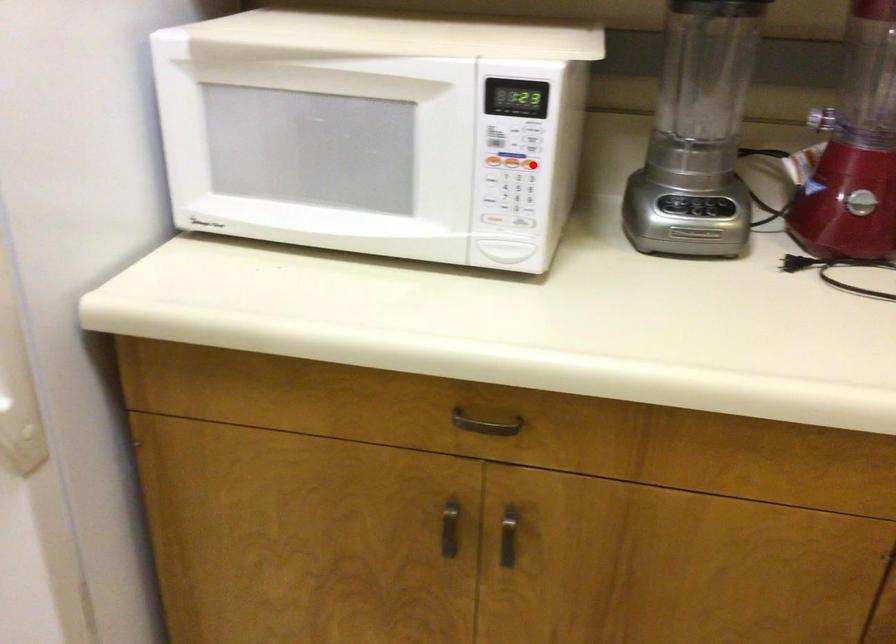
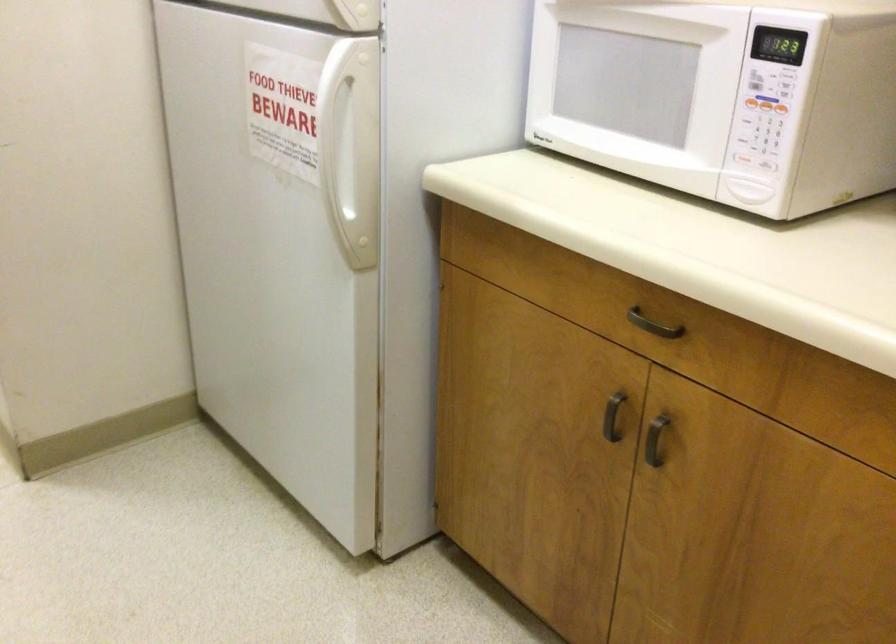
Find the pixel in the second image that matches the highlighted location in the first image.

(780, 108)